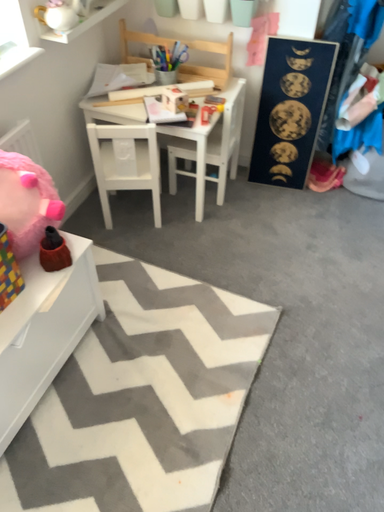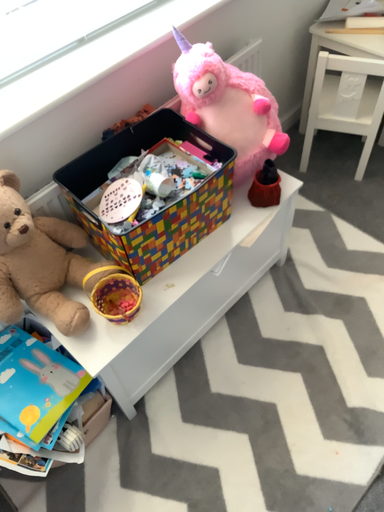
Question: How did the camera likely rotate when shooting the video?

Choices:
 (A) rotated right
 (B) rotated left

Answer: (B)